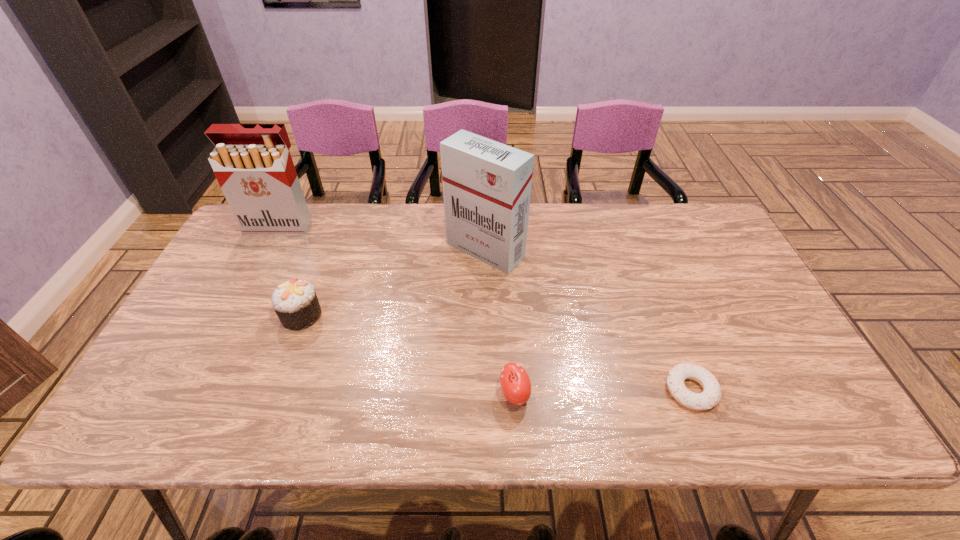
The height and width of the screenshot is (540, 960). Identify the location of free spot between the right cigarette case and the apple. (500, 322).

Locate an element on the screen. The image size is (960, 540). object that stands as the fourth closest to the second shortest object is located at coordinates (252, 163).

I want to click on object that is the nearest to the apple, so click(711, 395).

Locate an element on the screen. The width and height of the screenshot is (960, 540). blank space that satisfies the following two spatial constraints: 1. with the lid open on the leftmost object; 2. on the left side of the cupcake is located at coordinates [232, 315].

This screenshot has height=540, width=960. In order to click on vacant area that satisfies the following two spatial constraints: 1. with the lid open on the leftmost object; 2. on the left side of the rightmost object in this screenshot , I will do `click(194, 390)`.

Locate an element on the screen. vacant space that satisfies the following two spatial constraints: 1. with the lid open on the rightmost object; 2. on the right side of the leftmost object is located at coordinates (194, 390).

In order to click on free location that satisfies the following two spatial constraints: 1. on the back side of the apple; 2. on the left side of the doughnut in this screenshot , I will do `click(515, 390)`.